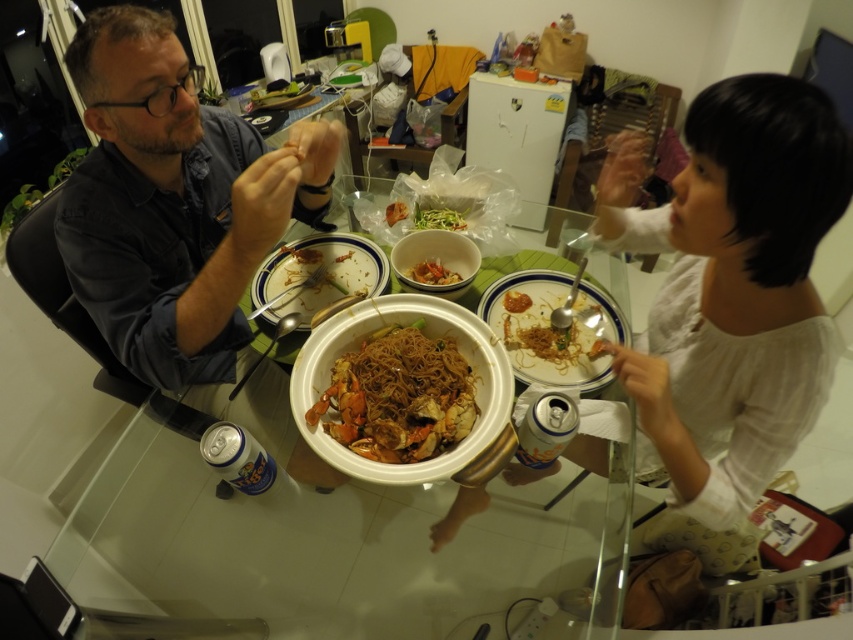
Identify the location of brown matte noodles at center. The height and width of the screenshot is (640, 853). (398, 396).

Who is higher up, brown matte noodles at center or green matte vegetable at center?

Positioned higher is green matte vegetable at center.

Does point (456, 420) come behind point (422, 218)?

No, (456, 420) is closer to viewer.

The height and width of the screenshot is (640, 853). What are the coordinates of `brown matte noodles at center` in the screenshot? It's located at (398, 396).

Is point (575, 566) farther from viewer compared to point (592, 300)?

No, it is in front of (592, 300).

Can you confirm if transparent glass table at center is shorter than brown matte noodles at right?

In fact, transparent glass table at center may be taller than brown matte noodles at right.

I want to click on transparent glass table at center, so click(305, 545).

Is white matte bowl at center closer to camera compared to shiny orange crab at center?

Yes, it is.

Is point (454, 273) less distant than point (433, 273)?

No.

Locate an element on the screen. white matte bowl at center is located at coordinates (434, 262).